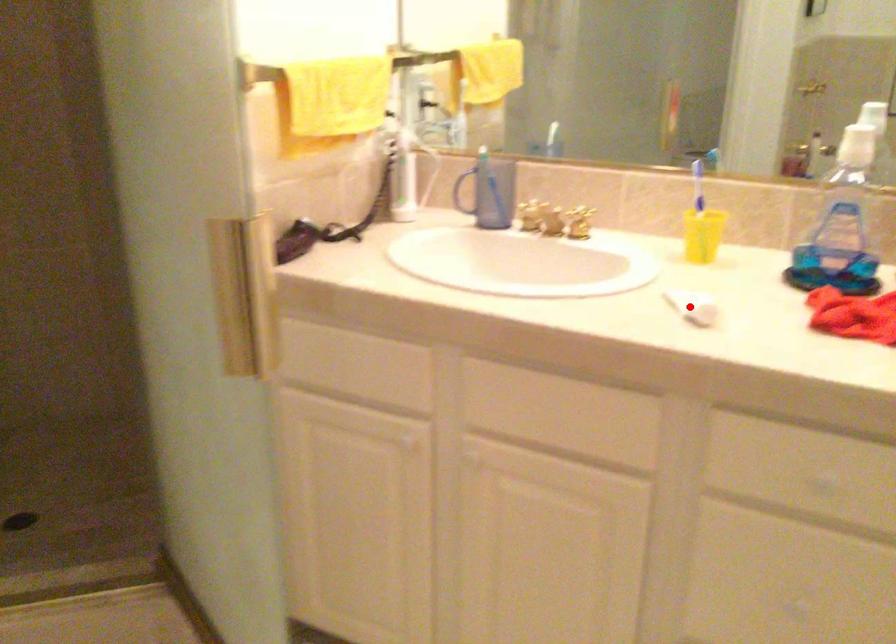
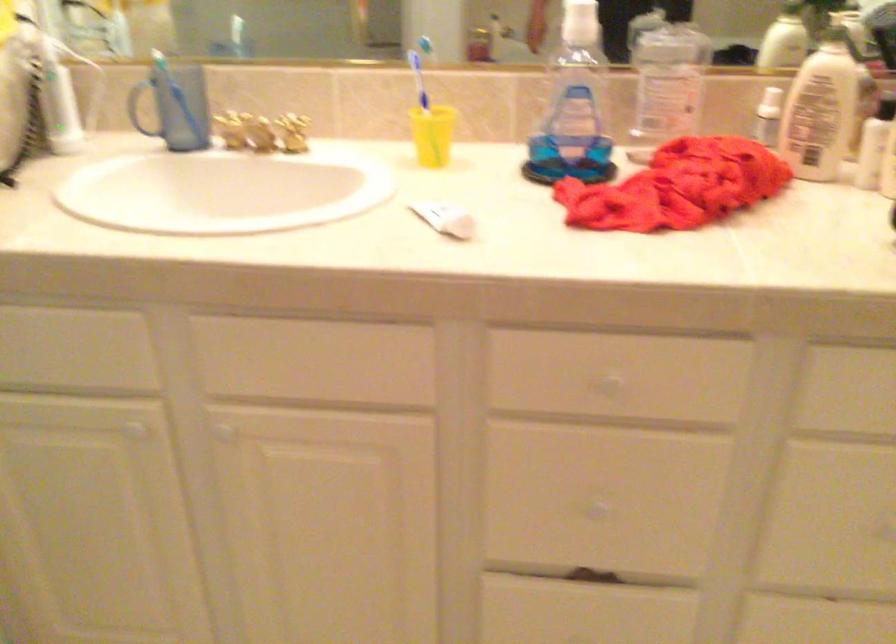
The point at the highlighted location is marked in the first image. Where is the corresponding point in the second image?

(444, 219)